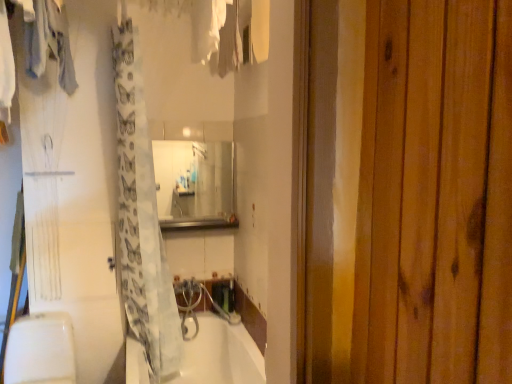
This screenshot has height=384, width=512. Describe the element at coordinates (193, 179) in the screenshot. I see `clear glass mirror at center` at that location.

How much space does light gray fabric at upper left, which is the first clothing from left to right, occupy vertically?

light gray fabric at upper left, which is the first clothing from left to right, is 21.56 inches in height.

This screenshot has width=512, height=384. Identify the location of white fabric at upper center, which appears as the 1th clothing when viewed from the right. (207, 28).

In order to click on clear glass mirror at center in this screenshot , I will do `click(193, 179)`.

Which of these two, white glossy bathtub at lower center or metallic stainless steel at center, is thinner?

metallic stainless steel at center is thinner.

Is white glossy bathtub at lower center aimed at metallic stainless steel at center?

No, white glossy bathtub at lower center does not turn towards metallic stainless steel at center.

Identify the location of balustrade lying on the left of white glossy bathtub at lower center. The height and width of the screenshot is (384, 512). (199, 223).

Choose the correct answer: Is clear glass mirror at center inside translucent white shower curtain at center or outside it?

clear glass mirror at center is located beyond the bounds of translucent white shower curtain at center.

Is clear glass mirror at center not near translucent white shower curtain at center?

Yes, clear glass mirror at center is far from translucent white shower curtain at center.

Considering the relative sizes of clear glass mirror at center and translucent white shower curtain at center in the image provided, is clear glass mirror at center smaller than translucent white shower curtain at center?

Indeed, clear glass mirror at center has a smaller size compared to translucent white shower curtain at center.

Relative to translucent white shower curtain at center, is clear glass mirror at center in front or behind?

Visually, clear glass mirror at center is located behind translucent white shower curtain at center.

From a real-world perspective, is metallic stainless steel at center positioned over white fabric at upper center, which appears as the 1th clothing when viewed from the right, based on gravity?

No, from a real-world perspective, metallic stainless steel at center is not on top of white fabric at upper center, which appears as the 1th clothing when viewed from the right.

Which of these two, metallic stainless steel at center or white fabric at upper center, which appears as the 1th clothing when viewed from the right, is bigger?

white fabric at upper center, which appears as the 1th clothing when viewed from the right, is bigger.

From the metallic stainless steel at center, count 2nd clothings forward and point to it. Please provide its 2D coordinates.

[(207, 28)]

Is white glossy bathtub at lower center looking in the opposite direction of clear glass mirror at center?

No, clear glass mirror at center is not at the back of white glossy bathtub at lower center.

Is white glossy bathtub at lower center bigger than clear glass mirror at center?

Correct, white glossy bathtub at lower center is larger in size than clear glass mirror at center.

The height and width of the screenshot is (384, 512). What are the coordinates of `bathtub beneath the clear glass mirror at center (from a real-world perspective)` in the screenshot? It's located at (220, 355).

Considering the sizes of objects white glossy bathtub at lower center and clear glass mirror at center in the image provided, who is thinner, white glossy bathtub at lower center or clear glass mirror at center?

clear glass mirror at center is thinner.

Is light gray fabric at upper left, which is the first clothing from left to right, positioned far away from clear glass mirror at center?

That's right, there is a large distance between light gray fabric at upper left, which is the first clothing from left to right, and clear glass mirror at center.

Between light gray fabric at upper left, which is the first clothing from left to right, and clear glass mirror at center, which one appears on the left side from the viewer's perspective?

light gray fabric at upper left, which is the first clothing from left to right, is more to the left.

Could you tell me if light gray fabric at upper left, which is the first clothing from left to right, is turned towards clear glass mirror at center?

No, light gray fabric at upper left, which is the first clothing from left to right, is not facing towards clear glass mirror at center.

Can you confirm if light gray fabric at upper left, acting as the 2th clothing starting from the right, is taller than clear glass mirror at center?

Yes, light gray fabric at upper left, acting as the 2th clothing starting from the right, is taller than clear glass mirror at center.

From the image's perspective, does translucent white shower curtain at center appear lower than white fabric at upper center, the second clothing in the left-to-right sequence?

Indeed, from the image's perspective, translucent white shower curtain at center is shown beneath white fabric at upper center, the second clothing in the left-to-right sequence.

Can white fabric at upper center, which appears as the 1th clothing when viewed from the right, be found inside translucent white shower curtain at center?

Actually, white fabric at upper center, which appears as the 1th clothing when viewed from the right, is outside translucent white shower curtain at center.

From a real-world perspective, which object stands above the other?

translucent white shower curtain at center, from a real-world perspective.

From their relative heights in the image, would you say metallic stainless steel at center is taller or shorter than translucent white shower curtain at center?

Considering their sizes, metallic stainless steel at center has less height than translucent white shower curtain at center.

Is metallic stainless steel at center not close to translucent white shower curtain at center?

That's not correct — metallic stainless steel at center is a little close to translucent white shower curtain at center.

In the image, is metallic stainless steel at center on the left side or the right side of translucent white shower curtain at center?

metallic stainless steel at center is positioned on translucent white shower curtain at center's right side.

This screenshot has width=512, height=384. I want to click on balustrade above the white glossy bathtub at lower center (from the image's perspective), so click(x=199, y=223).

At what (x,y) coordinates should I click in order to perform the action: click on shower curtain below the clear glass mirror at center (from a real-world perspective). Please return your answer as a coordinate pair (x, y). Looking at the image, I should click on (141, 218).

When comparing their distances from white glossy bathtub at lower center, does light gray fabric at upper left, which is the first clothing from left to right, or metallic stainless steel at center seem further?

light gray fabric at upper left, which is the first clothing from left to right, is positioned further to the anchor white glossy bathtub at lower center.

Based on their spatial positions, is light gray fabric at upper left, acting as the 2th clothing starting from the right, or white glossy bathtub at lower center further from metallic stainless steel at center?

The object further to metallic stainless steel at center is light gray fabric at upper left, acting as the 2th clothing starting from the right.

From the image, which object appears to be farther from metallic stainless steel at center, clear glass mirror at center or white glossy bathtub at lower center?

clear glass mirror at center is further to metallic stainless steel at center.

Based on the photo, when comparing their distances from translucent white shower curtain at center, does clear glass mirror at center or white fabric at upper center, which appears as the 1th clothing when viewed from the right, seem further?

Based on the image, clear glass mirror at center appears to be further to translucent white shower curtain at center.

Based on their spatial positions, is translucent white shower curtain at center or clear glass mirror at center closer to white glossy bathtub at lower center?

Among the two, translucent white shower curtain at center is located nearer to white glossy bathtub at lower center.

Consider the image. When comparing their distances from metallic stainless steel at center, does translucent white shower curtain at center or white glossy bathtub at lower center seem closer?

translucent white shower curtain at center is positioned closer to the anchor metallic stainless steel at center.

When comparing their distances from metallic stainless steel at center, does white fabric at upper center, the second clothing in the left-to-right sequence, or white glossy bathtub at lower center seem closer?

white glossy bathtub at lower center.

Considering their positions, is metallic stainless steel at center positioned further to light gray fabric at upper left, acting as the 2th clothing starting from the right, than clear glass mirror at center?

The object further to light gray fabric at upper left, acting as the 2th clothing starting from the right, is clear glass mirror at center.

At what (x,y) coordinates should I click in order to perform the action: click on clothing that lies between white fabric at upper center, which appears as the 1th clothing when viewed from the right, and translucent white shower curtain at center from top to bottom. Please return your answer as a coordinate pair (x, y). Looking at the image, I should click on (50, 43).

Locate an element on the screen. The image size is (512, 384). balustrade between translucent white shower curtain at center and clear glass mirror at center in the front-back direction is located at coordinates (199, 223).

The width and height of the screenshot is (512, 384). In order to click on clothing between white fabric at upper center, which appears as the 1th clothing when viewed from the right, and metallic stainless steel at center from front to back in this screenshot , I will do pos(50,43).

Locate an element on the screen. The image size is (512, 384). balustrade between translucent white shower curtain at center and white glossy bathtub at lower center from top to bottom is located at coordinates (199, 223).